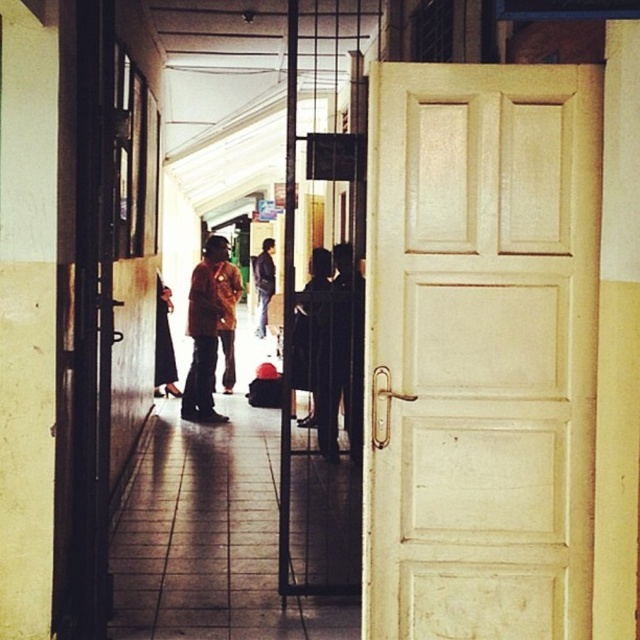
Is brown fabric shirt at center positioned before dark blue jeans at center?

Yes.

Is brown fabric shirt at center below dark blue jeans at center?

Yes.

What are the coordinates of `brown fabric shirt at center` in the screenshot? It's located at (228, 316).

The width and height of the screenshot is (640, 640). I want to click on brown fabric shirt at center, so click(228, 316).

Does white matte door at right lie in front of brown fabric shirt at center?

Yes.

Who is more distant from viewer, (589, 67) or (218, 289)?

Point (218, 289)

The height and width of the screenshot is (640, 640). Identify the location of white matte door at right. (481, 349).

The width and height of the screenshot is (640, 640). What are the coordinates of `white matte door at right` in the screenshot? It's located at (481, 349).

Between brown leather jacket at center and brown fabric shirt at center, which one is positioned lower?

Positioned lower is brown leather jacket at center.

Looking at this image, is brown leather jacket at center below brown fabric shirt at center?

Yes.

The image size is (640, 640). What do you see at coordinates (204, 333) in the screenshot?
I see `brown leather jacket at center` at bounding box center [204, 333].

In order to click on brown leather jacket at center in this screenshot , I will do `click(204, 333)`.